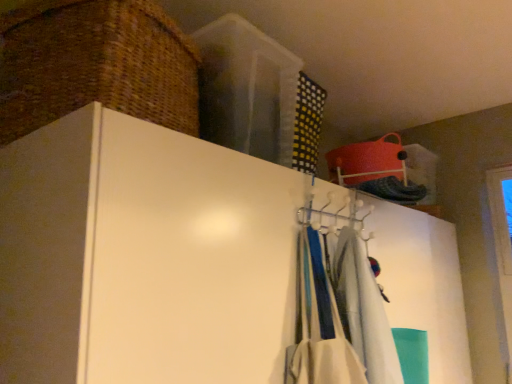
Identify the location of white matte cupboard at upper center. pos(143,256).

Can you confirm if woven brown basket at upper left is bigger than white matte cupboard at upper center?

Incorrect, woven brown basket at upper left is not larger than white matte cupboard at upper center.

Is woven brown basket at upper left not near white matte cupboard at upper center?

woven brown basket at upper left is near white matte cupboard at upper center, not far away.

Considering the positions of point (36, 41) and point (183, 167), is point (36, 41) closer or farther from the camera than point (183, 167)?

Point (36, 41) appears to be farther away from the viewer than point (183, 167).

Relative to white matte cupboard at upper center, is woven brown basket at upper left in front or behind?

In the image, woven brown basket at upper left appears behind white matte cupboard at upper center.

Is white plastic hanger at upper center beside woven brown basket at upper left?

There is a gap between white plastic hanger at upper center and woven brown basket at upper left.

Is white plastic hanger at upper center completely or partially outside of woven brown basket at upper left?

Absolutely, white plastic hanger at upper center is external to woven brown basket at upper left.

From a real-world perspective, is white plastic hanger at upper center on top of woven brown basket at upper left?

Actually, white plastic hanger at upper center is physically below woven brown basket at upper left in the real world.

Is woven brown basket at upper left at the back of white plastic hanger at upper center?

white plastic hanger at upper center is not turned away from woven brown basket at upper left.

From the picture: Does white matte cupboard at upper center have a larger size compared to woven brown basket at upper left?

Indeed, white matte cupboard at upper center has a larger size compared to woven brown basket at upper left.

What's the angular difference between white matte cupboard at upper center and woven brown basket at upper left's facing directions?

7.83 degrees.

Is point (457, 271) positioned after point (25, 23)?

Yes, it is.

From the image's perspective, which is above, white matte cupboard at upper center or woven brown basket at upper left?

From the image's view, woven brown basket at upper left is above.

Are white fabric scarf at center and white matte cupboard at upper center making contact?

No, white fabric scarf at center is not touching white matte cupboard at upper center.

Considering the sizes of objects white fabric scarf at center and white matte cupboard at upper center in the image provided, who is wider, white fabric scarf at center or white matte cupboard at upper center?

white matte cupboard at upper center is wider.

From a real-world perspective, is white fabric scarf at center positioned above or below white matte cupboard at upper center?

Clearly, from a real-world perspective, white fabric scarf at center is above white matte cupboard at upper center.

Is point (369, 268) positioned before point (215, 361)?

No, it is not.

Is white plastic hanger at upper center a part of white matte cupboard at upper center?

Yes, white plastic hanger at upper center is inside white matte cupboard at upper center.

Is white matte cupboard at upper center wider or thinner than white plastic hanger at upper center?

Considering their sizes, white matte cupboard at upper center looks broader than white plastic hanger at upper center.

From a real-world perspective, is white matte cupboard at upper center physically above white plastic hanger at upper center?

No, from a real-world perspective, white matte cupboard at upper center is not over white plastic hanger at upper center

Which is more to the right, woven brown basket at upper left or white fabric scarf at center?

From the viewer's perspective, white fabric scarf at center appears more on the right side.

Is woven brown basket at upper left not inside white fabric scarf at center?

woven brown basket at upper left lies outside white fabric scarf at center's area.

Measure the distance between woven brown basket at upper left and white fabric scarf at center.

woven brown basket at upper left is 31.18 inches away from white fabric scarf at center.

Can you see woven brown basket at upper left touching white fabric scarf at center?

No, woven brown basket at upper left is not in contact with white fabric scarf at center.

Would you say white plastic hanger at upper center is a long distance from white fabric scarf at center?

They are positioned close to each other.

Considering the positions of points (359, 234) and (381, 316), is point (359, 234) closer to camera compared to point (381, 316)?

No, (359, 234) is behind (381, 316).

Considering the positions of objects white plastic hanger at upper center and white fabric scarf at center in the image provided, who is more to the right, white plastic hanger at upper center or white fabric scarf at center?

white fabric scarf at center.

Does white plastic hanger at upper center turn towards white fabric scarf at center?

No, white plastic hanger at upper center is not oriented towards white fabric scarf at center.

You are a GUI agent. You are given a task and a screenshot of the screen. Output one action in this format:
    pyautogui.click(x=<x>, y=<y>)
    Task: Click on the basket positioned vertically above the white matte cupboard at upper center (from a real-world perspective)
    This screenshot has width=512, height=384.
    Given the screenshot: What is the action you would take?
    pyautogui.click(x=95, y=64)

Locate an element on the screen. The height and width of the screenshot is (384, 512). hanger behind the woven brown basket at upper left is located at coordinates (336, 215).

From the picture: When comparing their distances from woven brown basket at upper left, does white plastic hanger at upper center or white matte cupboard at upper center seem closer?

white matte cupboard at upper center lies closer to woven brown basket at upper left than the other object.

Estimate the real-world distances between objects in this image. Which object is further from white fabric scarf at center, woven brown basket at upper left or white plastic hanger at upper center?

Among the two, woven brown basket at upper left is located further to white fabric scarf at center.

Based on their spatial positions, is white fabric scarf at center or white plastic hanger at upper center further from woven brown basket at upper left?

white fabric scarf at center lies further to woven brown basket at upper left than the other object.

From the picture: Estimate the real-world distances between objects in this image. Which object is closer to woven brown basket at upper left, white fabric scarf at center or white matte cupboard at upper center?

Among the two, white matte cupboard at upper center is located nearer to woven brown basket at upper left.

Consider the image. Looking at the image, which one is located further to white matte cupboard at upper center, white fabric scarf at center or white plastic hanger at upper center?

The object further to white matte cupboard at upper center is white fabric scarf at center.

Estimate the real-world distances between objects in this image. Which object is closer to woven brown basket at upper left, white plastic hanger at upper center or white fabric scarf at center?

white plastic hanger at upper center.

From the image, which object appears to be farther from white plastic hanger at upper center, white fabric scarf at center or woven brown basket at upper left?

woven brown basket at upper left is positioned further to the anchor white plastic hanger at upper center.

When comparing their distances from white fabric scarf at center, does white plastic hanger at upper center or white matte cupboard at upper center seem further?

white matte cupboard at upper center lies further to white fabric scarf at center than the other object.

Where is `clothing between woven brown basket at upper left and white matte cupboard at upper center vertically`? clothing between woven brown basket at upper left and white matte cupboard at upper center vertically is located at coordinates (362, 310).

Image resolution: width=512 pixels, height=384 pixels. Identify the location of hanger between woven brown basket at upper left and white matte cupboard at upper center in the up-down direction. (336, 215).

At what (x,y) coordinates should I click in order to perform the action: click on hanger between woven brown basket at upper left and white fabric scarf at center. Please return your answer as a coordinate pair (x, y). Looking at the image, I should click on (336, 215).

The height and width of the screenshot is (384, 512). What are the coordinates of `hanger between white matte cupboard at upper center and white fabric scarf at center in the front-back direction` in the screenshot? It's located at (336, 215).